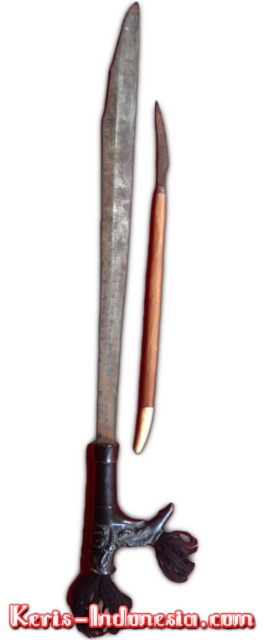
From the picture: Between wooden-handled knife at center and black text at center, which one is positioned higher?

Positioned higher is wooden-handled knife at center.

Can you confirm if wooden-handled knife at center is taller than black text at center?

Indeed, wooden-handled knife at center has a greater height compared to black text at center.

The image size is (263, 640). Find the location of `wooden-handled knife at center`. wooden-handled knife at center is located at coordinates (152, 291).

You are a GUI agent. You are given a task and a screenshot of the screen. Output one action in this format:
    pyautogui.click(x=<x>, y=<y>)
    Task: Click on the wooden-handled knife at center
    
    Given the screenshot: What is the action you would take?
    pyautogui.click(x=152, y=291)

Is rusty metal sword at center shorter than wooden-handled knife at center?

No, rusty metal sword at center is not shorter than wooden-handled knife at center.

Is point (103, 536) less distant than point (159, 145)?

That is True.

Locate an element on the screen. rusty metal sword at center is located at coordinates (117, 360).

Does shiny metallic sword at center have a smaller size compared to black text at center?

Actually, shiny metallic sword at center might be larger than black text at center.

Who is more distant from viewer, [112,124] or [128,624]?

Positioned behind is point [112,124].

Is point (119, 275) closer to camera compared to point (24, 618)?

No.

At what (x,y) coordinates should I click in order to perform the action: click on shiny metallic sword at center. Please return your answer as a coordinate pair (x, y). Looking at the image, I should click on (115, 216).